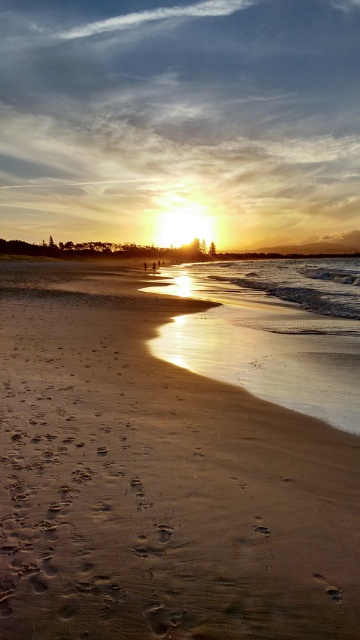
Is point (65, 362) positioned before point (210, 284)?

Yes, it is in front of point (210, 284).

Based on the photo, is sandy beach at lower left thinner than shiny wet sand at lower center?

Correct, sandy beach at lower left's width is less than shiny wet sand at lower center's.

What do you see at coordinates (156, 481) in the screenshot? This screenshot has width=360, height=640. I see `sandy beach at lower left` at bounding box center [156, 481].

Image resolution: width=360 pixels, height=640 pixels. I want to click on sandy beach at lower left, so click(156, 481).